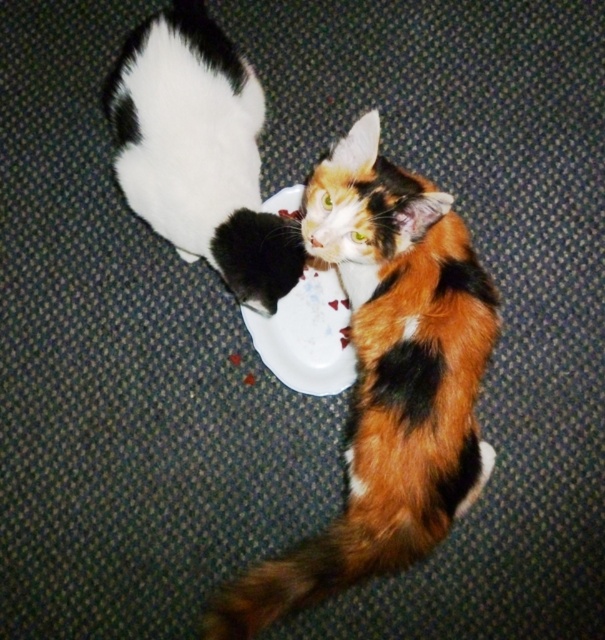
You are a photographer trying to capture the calico fur cat at center. You need to position your camera at point (387,380). Is this point the correct location to focus on the cat?

Yes, the point (387,380) corresponds to the calico fur cat at center, so focusing there will capture the cat accurately.

You are a photographer standing at a distance from the calico fur cat at center. You want to take a closeup photo of the cat without disturbing it. Considering the distance between you and the cat, what is the minimum focal length lens you should use if your camera has a sensor size of 24mm x 36mm and you want to fill the frame with the cat?

The minimum focal length lens required would depend on the desired magnification and the cat size in the frame. However, since the distance between you and the calico fur cat at center is 3.71 feet, a lens with a focal length of approximately 50mm to 85mm would be suitable for a closeup without distortion, assuming standard framing.

You are taking a photo of two points in the image. The first point is point (132, 56) and the second is point (318, 356). Which point will appear larger in your photo?

Point (132, 56) is closer to the camera than point (318, 356), so it will appear larger in the photo.